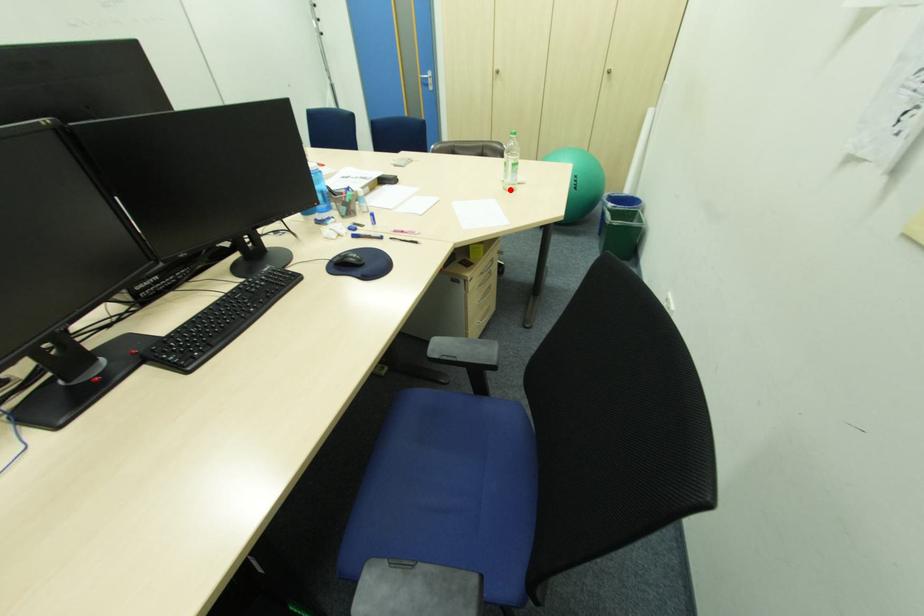
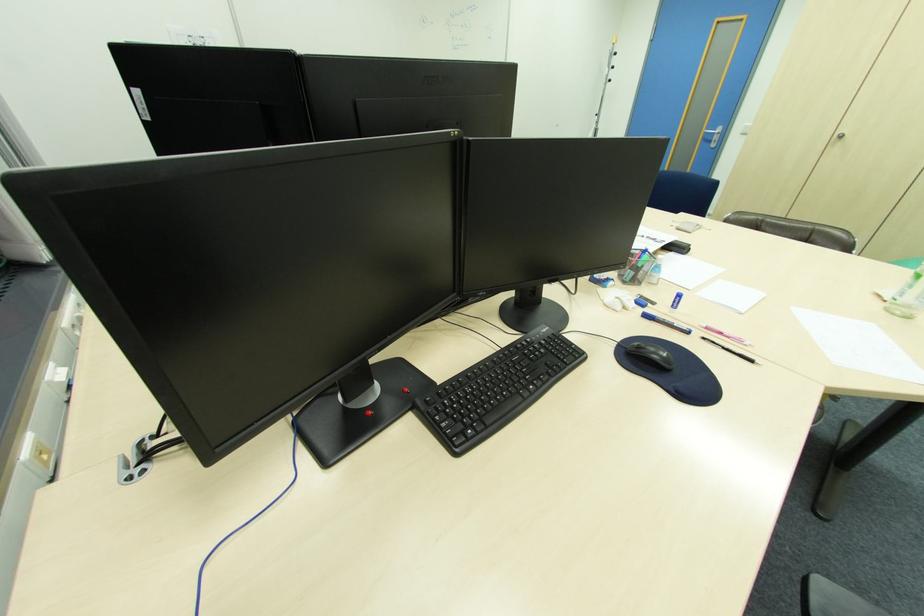
In the second image, find the point that corresponds to the highlighted location in the first image.

(894, 310)